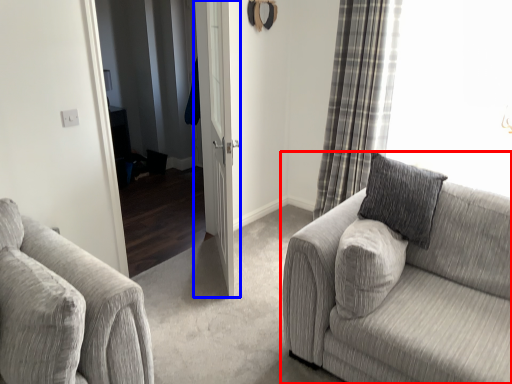
Question: Among these objects, which one is farthest to the camera, studio couch (highlighted by a red box) or door (highlighted by a blue box)?

Choices:
 (A) studio couch
 (B) door

Answer: (B)